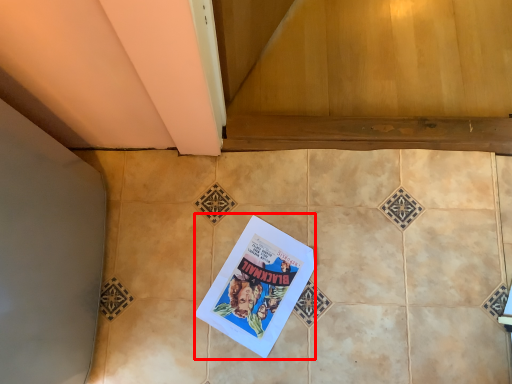
Question: From the image's perspective, considering the relative positions of comic book (annotated by the red box) and ceramic tile in the image provided, where is comic book (annotated by the red box) located with respect to the staircase?

Choices:
 (A) above
 (B) below

Answer: (B)